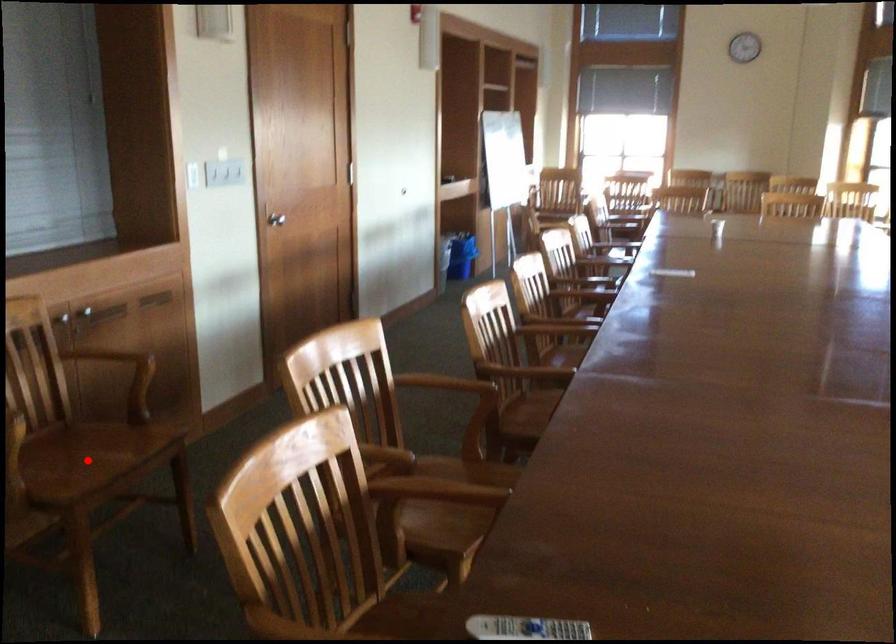
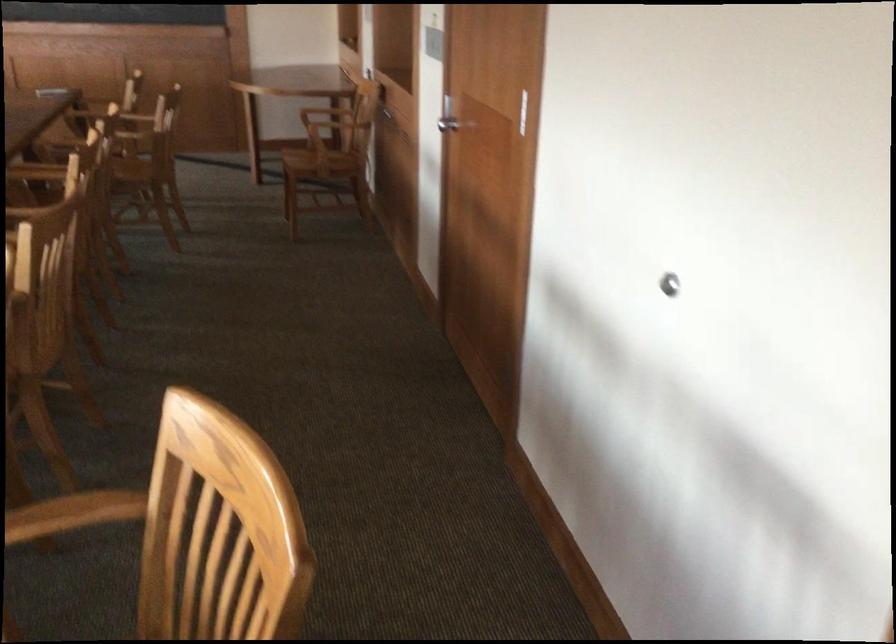
Question: I am providing you with two images of the same scene from different viewpoints. A red point is marked on the first image. At the location where the point appears in image 1, is it still visible in image 2?

Choices:
 (A) Yes
 (B) No

Answer: (B)